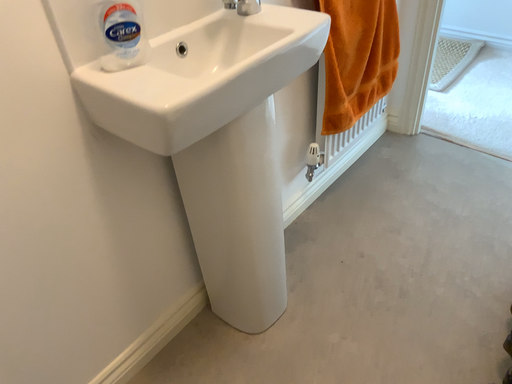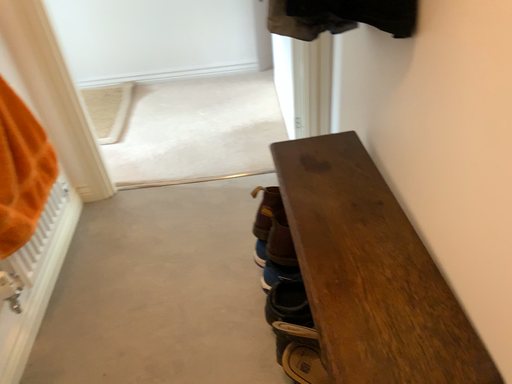
Question: How did the camera likely rotate when shooting the video?

Choices:
 (A) rotated upward
 (B) rotated downward

Answer: (A)